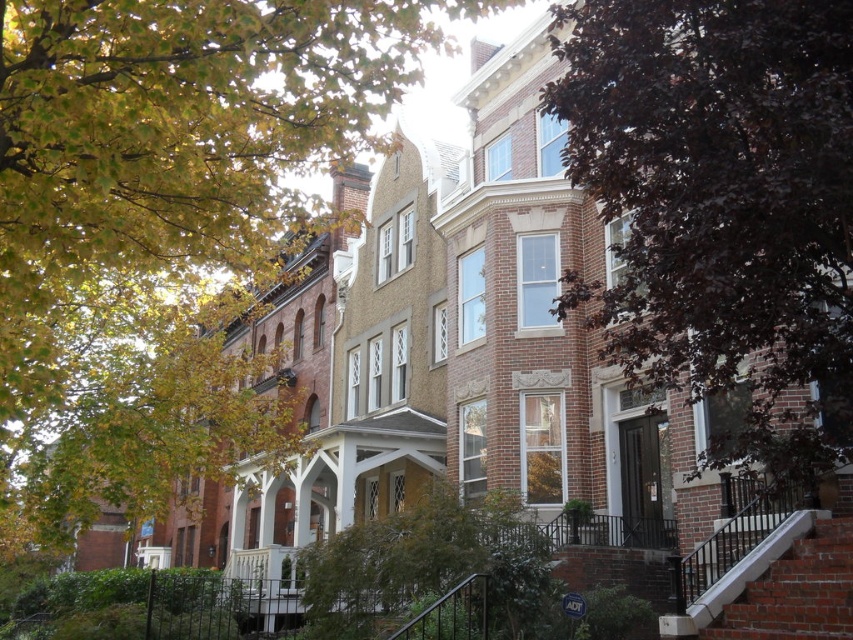
You are a delivery person with a cart that is 2 meters wide. You need to navigate between the purple leafy tree at center and the white concrete stairs at lower right to reach the delivery point. Can your cart fit through the space between them?

The distance between the purple leafy tree at center and the white concrete stairs at lower right is 14.47 meters, which is significantly wider than the 2 meter width of the cart. Therefore, the cart can easily pass through the space between them.

You are a drone operator trying to capture aerial footage of the brick townhouses. You have two points marked on your map for camera positioning. The first point is at coordinates point (48,529), and the second is at point (630,74). Which point should you choose to ensure the camera can capture the entire row of townhouses without any obstruction from the trees?

You should choose point (630,74) because point (48,529) is behind it, meaning the trees might obstruct the view from the latter point.